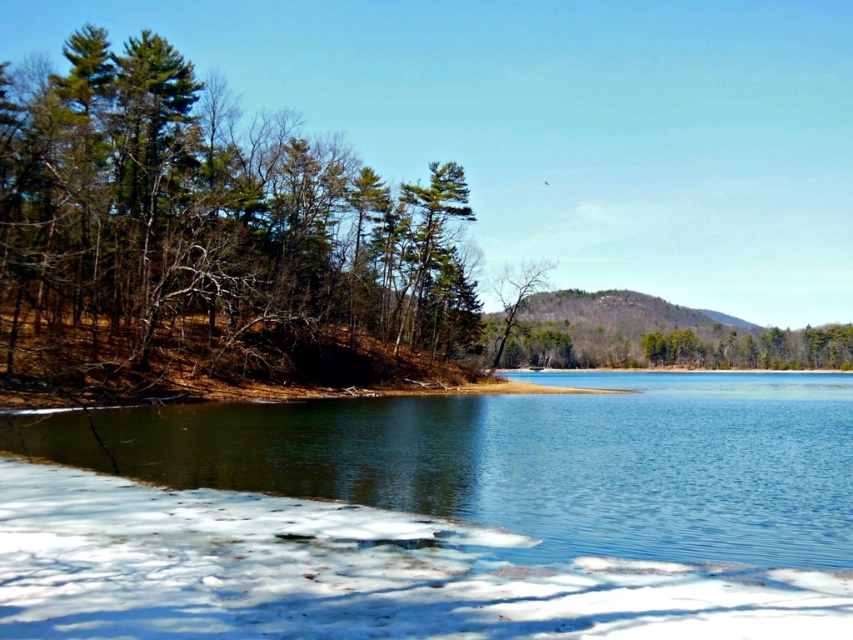
You are standing at the lakeside and want to take a photo of both the point at coordinates (44,168) and the point at coordinates (780,584). Which point will appear closer to the camera in your photo?

The point at coordinates (44,168) will appear closer to the camera in the photo because it is further to the camera than the point at coordinates (780,584).

You are an ice fisherman who wants to check the ice thickness before drilling a hole. You see clear water at lower center and bare branches at center. Which object should you avoid standing on to ensure safety?

You should avoid standing on the clear water at lower center because it is below the bare branches at center, indicating it might be a thinner or open area of ice where the water is visible. The bare branches at center are likely on solid ground, so standing there would be safer.

Consider the image. You are planning to build a snowman using the white fluffy snow at lower left and the bare branches at center. Since the snow is fluffy, you need to know which area is wider to gather enough snow. Which object is wider?

The white fluffy snow at lower left is less than the width of the bare branches at center, so you should gather snow from the area of the bare branches at center since it is wider.